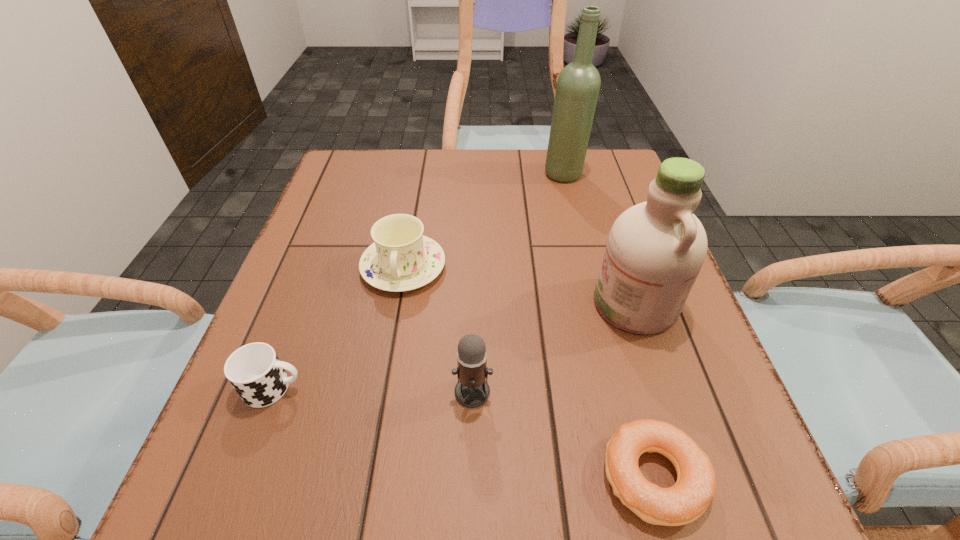
Locate an element on the screen. This screenshot has height=540, width=960. object located in the near edge section of the desktop is located at coordinates (687, 500).

You are a GUI agent. You are given a task and a screenshot of the screen. Output one action in this format:
    pyautogui.click(x=<x>, y=<y>)
    Task: Click on the chinaware that is positioned at the left edge
    The width and height of the screenshot is (960, 540).
    Given the screenshot: What is the action you would take?
    pyautogui.click(x=401, y=259)

Find the location of `cup at the left edge`. cup at the left edge is located at coordinates (254, 370).

What are the coordinates of `wine bottle that is positioned at the right edge` in the screenshot? It's located at (578, 84).

Identify the location of cleansing agent that is at the right edge. pos(655,250).

Image resolution: width=960 pixels, height=540 pixels. I want to click on bagel positioned at the right edge, so click(687, 500).

Where is `object located in the far right corner section of the desktop`? Image resolution: width=960 pixels, height=540 pixels. object located in the far right corner section of the desktop is located at coordinates (578, 84).

Find the location of a particular element. This screenshot has width=960, height=540. object at the near right corner is located at coordinates (687, 500).

Locate an element on the screen. free space at the far edge of the desktop is located at coordinates (567, 192).

Locate an element on the screen. The height and width of the screenshot is (540, 960). free location at the near edge of the desktop is located at coordinates (522, 494).